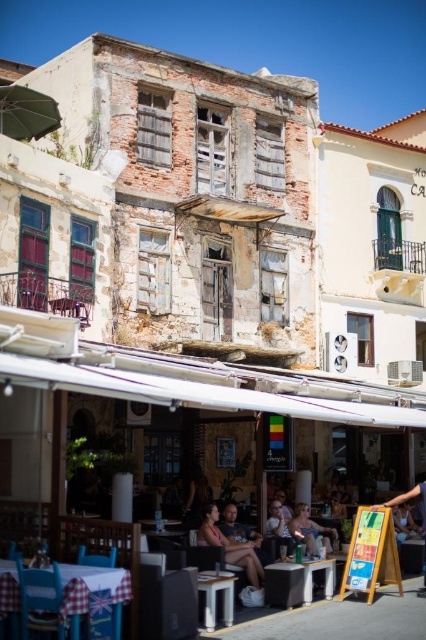
Between point (325, 563) and point (330, 545), which one is positioned in front?

Point (325, 563) is more forward.

Who is more distant from viewer, (328,564) or (336,531)?

Positioned behind is point (336,531).

Locate an element on the screen. The width and height of the screenshot is (426, 640). matte black table at center is located at coordinates (296, 580).

Is point (57, 120) in front of point (299, 532)?

No.

How far apart are green matte umbrella at upper left and matte pink tank top at center?

A distance of 28.01 meters exists between green matte umbrella at upper left and matte pink tank top at center.

Describe the element at coordinates (26, 113) in the screenshot. I see `green matte umbrella at upper left` at that location.

Image resolution: width=426 pixels, height=640 pixels. Identify the location of green matte umbrella at upper left. (26, 113).

Looking at this image, can you confirm if checkered fabric table at lower left is positioned to the left of matte pink tank top at center?

Yes, checkered fabric table at lower left is to the left of matte pink tank top at center.

Between checkered fabric table at lower left and matte pink tank top at center, which one appears on the right side from the viewer's perspective?

From the viewer's perspective, matte pink tank top at center appears more on the right side.

Describe the element at coordinates (92, 588) in the screenshot. The height and width of the screenshot is (640, 426). I see `checkered fabric table at lower left` at that location.

Locate an element on the screen. Image resolution: width=426 pixels, height=640 pixels. checkered fabric table at lower left is located at coordinates (92, 588).